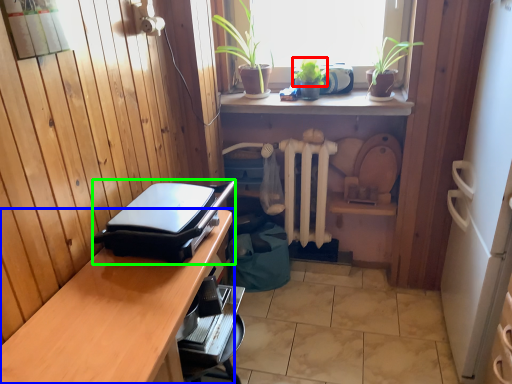
Question: Which object is positioned farthest from plant (highlighted by a red box)? Select from desk (highlighted by a blue box) and appliance (highlighted by a green box).

Choices:
 (A) desk
 (B) appliance

Answer: (A)